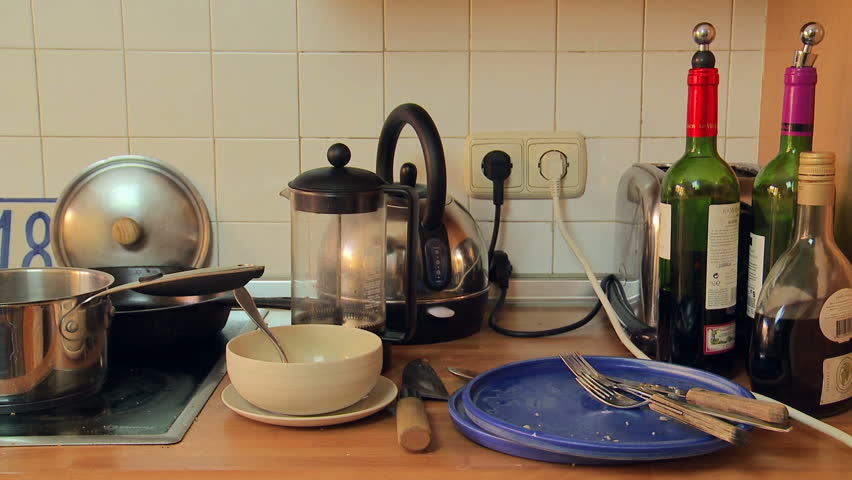
The width and height of the screenshot is (852, 480). In order to click on bowl in this screenshot , I will do `click(330, 388)`.